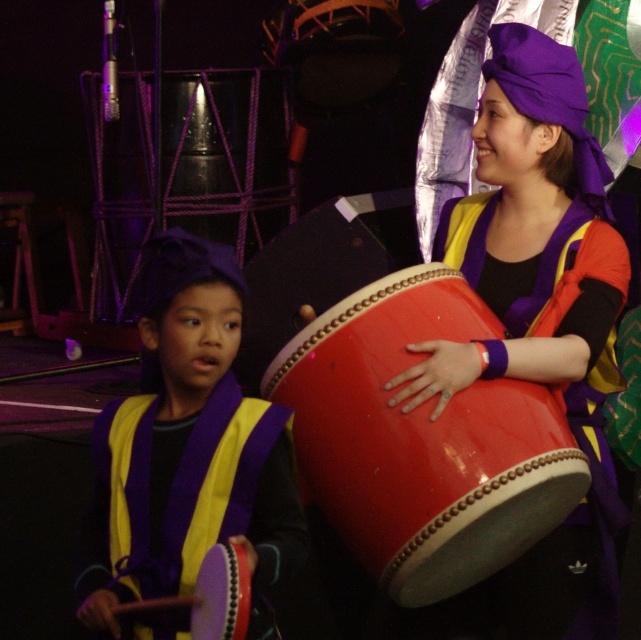
Question: Is shiny purple drum at center positioned at the back of shiny red drum at center?

Choices:
 (A) no
 (B) yes

Answer: (B)

Question: Which point is closer to the camera taking this photo?

Choices:
 (A) (379, 547)
 (B) (535, 205)

Answer: (A)

Question: Is shiny purple drum at center below shiny red drum at center?

Choices:
 (A) no
 (B) yes

Answer: (A)

Question: Which point appears closest to the camera in this image?

Choices:
 (A) (628, 518)
 (B) (369, 291)

Answer: (B)

Question: Which object is closer to the camera taking this photo?

Choices:
 (A) shiny purple drum at center
 (B) shiny red drum at center
 (C) purple matte drumstick at left

Answer: (C)

Question: Is shiny red drum at center thinner than purple matte drumstick at left?

Choices:
 (A) no
 (B) yes

Answer: (A)